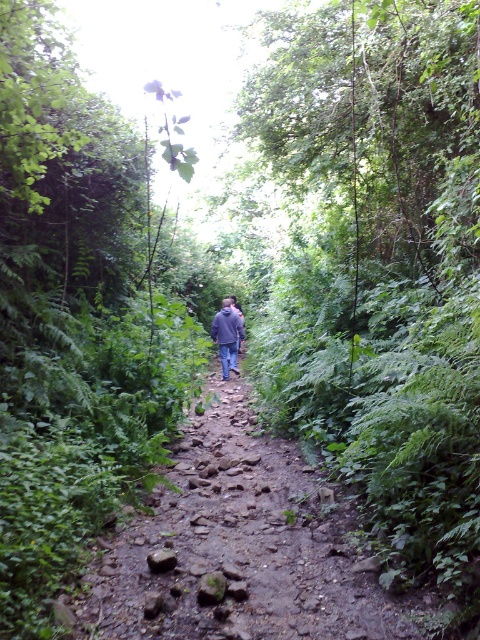
Question: Can you confirm if dusty stone path at center is positioned below dark blue jeans at center?

Choices:
 (A) yes
 (B) no

Answer: (A)

Question: Does dusty stone path at center appear on the left side of dark blue jeans at center?

Choices:
 (A) no
 (B) yes

Answer: (A)

Question: Among these objects, which one is nearest to the camera?

Choices:
 (A) dark blue jeans at center
 (B) dusty stone path at center

Answer: (B)

Question: In this image, where is dusty stone path at center located relative to dark blue jeans at center?

Choices:
 (A) below
 (B) above

Answer: (A)